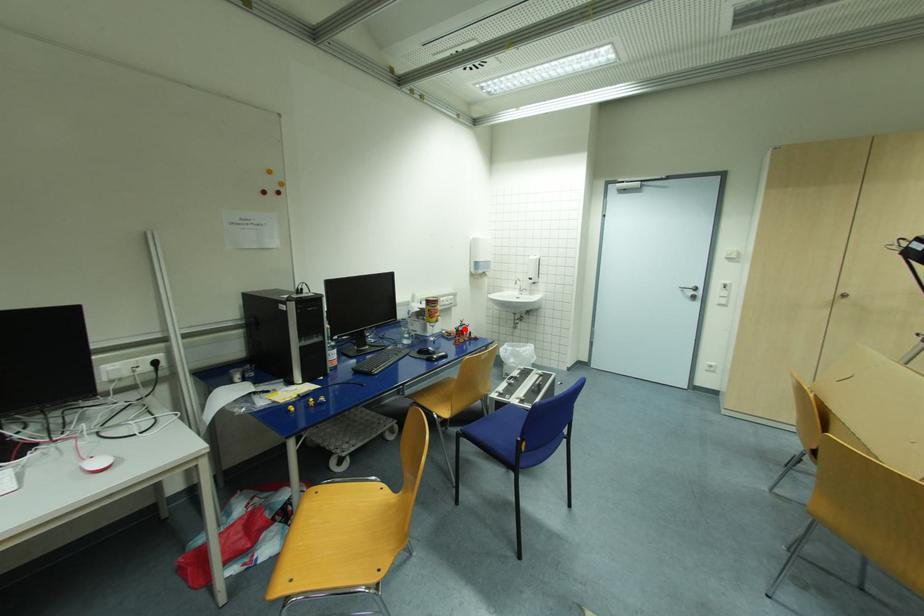
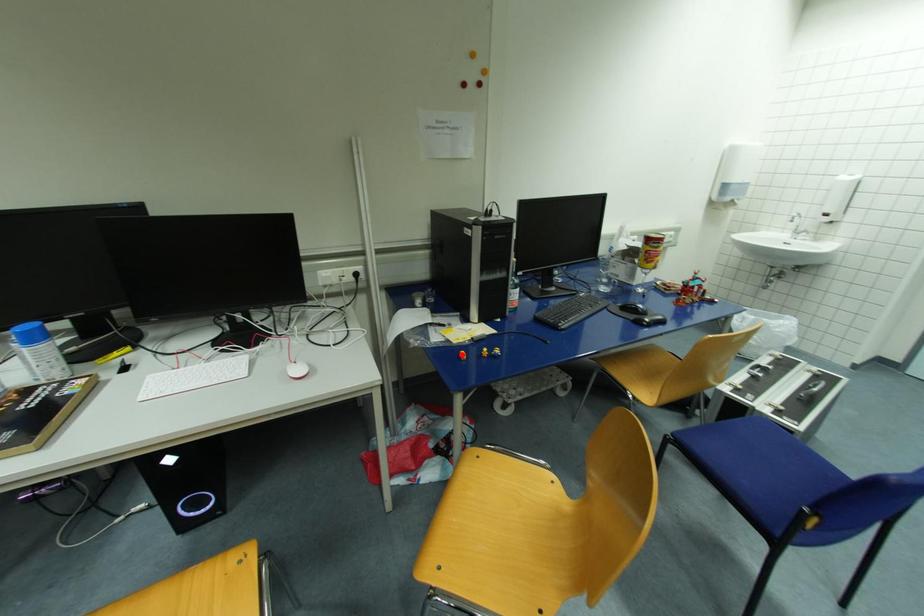
I am providing you with two images of the same scene from different viewpoints. A red point is marked on the first image and another point is marked on the second image. Does the point marked in image1 correspond to the same location as the one in image2?

No